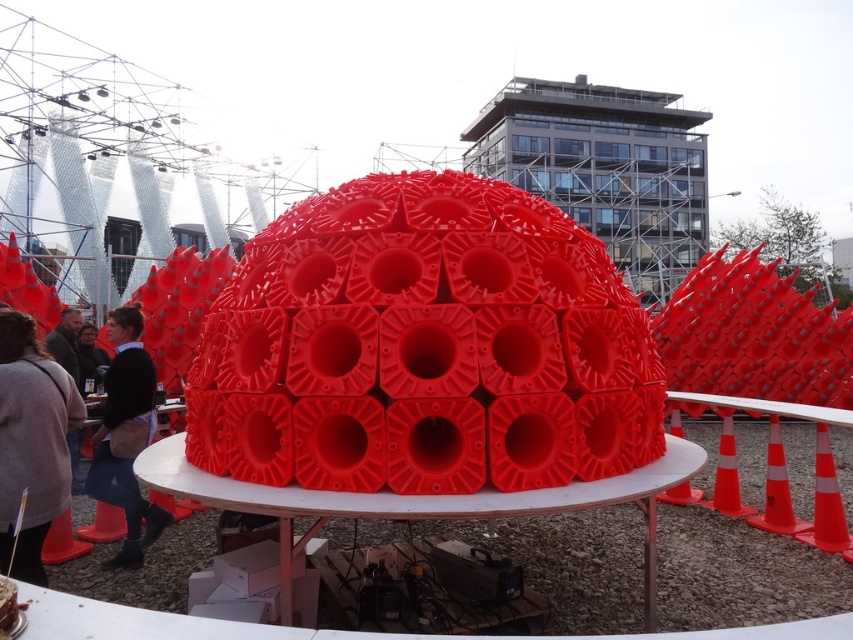
Question: Which of the following is the farthest from the observer?

Choices:
 (A) (102, 355)
 (B) (9, 428)

Answer: (A)

Question: Which point appears farthest from the camera in this image?

Choices:
 (A) (770, 515)
 (B) (735, 480)
 (C) (59, 442)

Answer: (B)

Question: Does dark gray sweater at lower left lie in front of matte black jacket at center?

Choices:
 (A) yes
 (B) no

Answer: (A)

Question: Does dark gray sweater at lower left appear on the right side of orange traffic cone at right?

Choices:
 (A) no
 (B) yes

Answer: (A)

Question: Considering the real-world distances, which object is closest to the rubber cone at lower left?

Choices:
 (A) orange reflective cone at center
 (B) denim jacket at lower left

Answer: (B)

Question: Considering the relative positions of orange reflective cone at lower right and orange plastic cone at right in the image provided, where is orange reflective cone at lower right located with respect to orange plastic cone at right?

Choices:
 (A) left
 (B) right

Answer: (B)